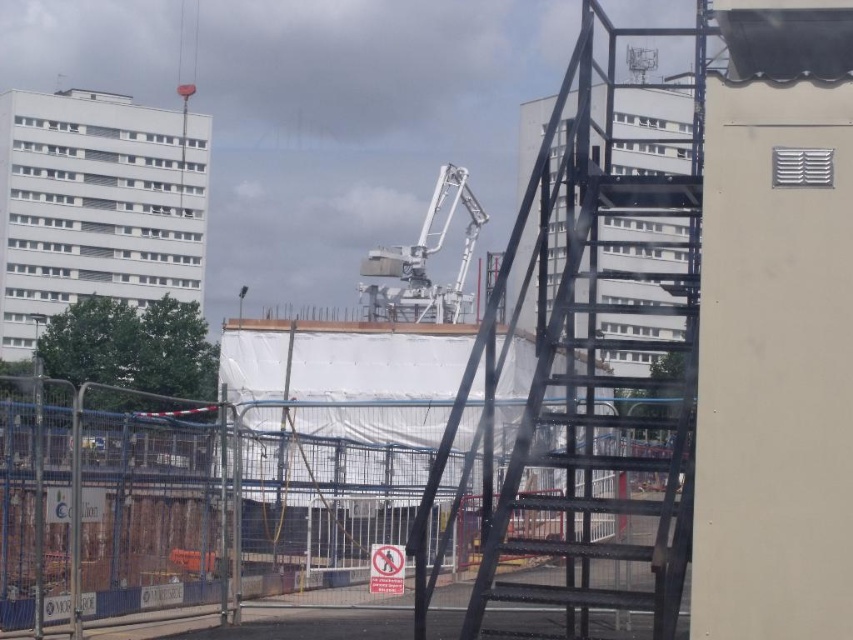
You are a construction worker standing at the entrance of the construction site. You need to check the distance between you and the blue metal fence at center to ensure safety regulations are met. According to safety guidelines, workers must stay at least 5 meters away from the fence. Is the distance sufficient?

The blue metal fence at center is 6.58 meters away from the viewer, which exceeds the required 5 meters safety distance. Therefore, the distance is sufficient.

You are a construction worker who needs to secure safety barriers. You have the blue metal fence at center and the black metal ladder at center. Which one should you secure first if you want to start from the closest object to you?

The blue metal fence at center is closer to the viewer than the black metal ladder at center, so you should secure the blue metal fence at center first.